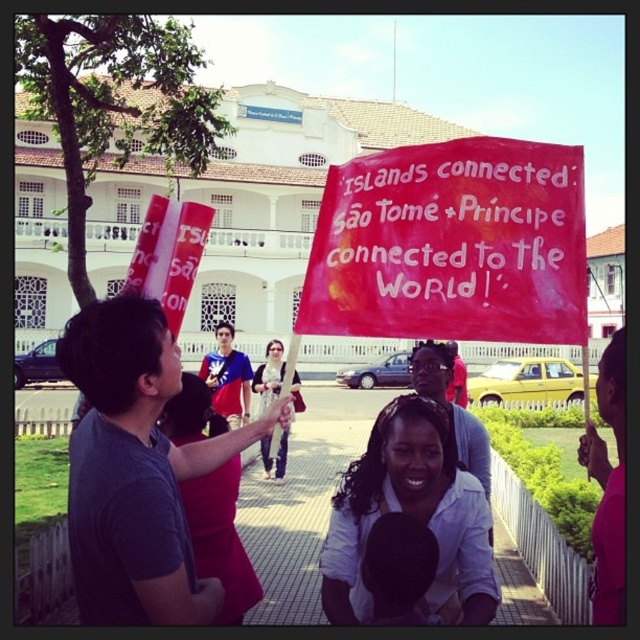
Question: Which point is closer to the camera taking this photo?

Choices:
 (A) coord(227,612)
 (B) coord(392,422)
 (C) coord(282,449)

Answer: (A)

Question: Which object is positioned farthest from the matte black shirt at center?

Choices:
 (A) matte red dress at center
 (B) white matte shirt at center
 (C) red fabric banner at center

Answer: (C)

Question: In this image, where is red fabric banner at center located relative to matte red dress at center?

Choices:
 (A) left
 (B) right

Answer: (B)

Question: Does red fabric banner at center lie behind white matte shirt at center?

Choices:
 (A) no
 (B) yes

Answer: (B)

Question: Estimate the real-world distances between objects in this image. Which object is closer to the white matte shirt at center?

Choices:
 (A) red fabric banner at center
 (B) matte black shirt at center

Answer: (A)

Question: Does red fabric banner at center appear on the left side of white matte shirt at center?

Choices:
 (A) no
 (B) yes

Answer: (A)